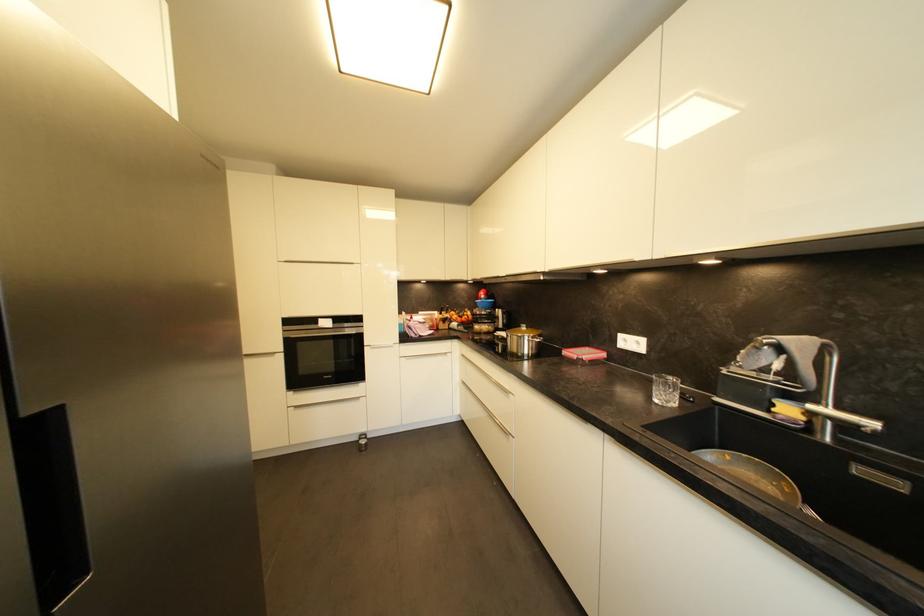
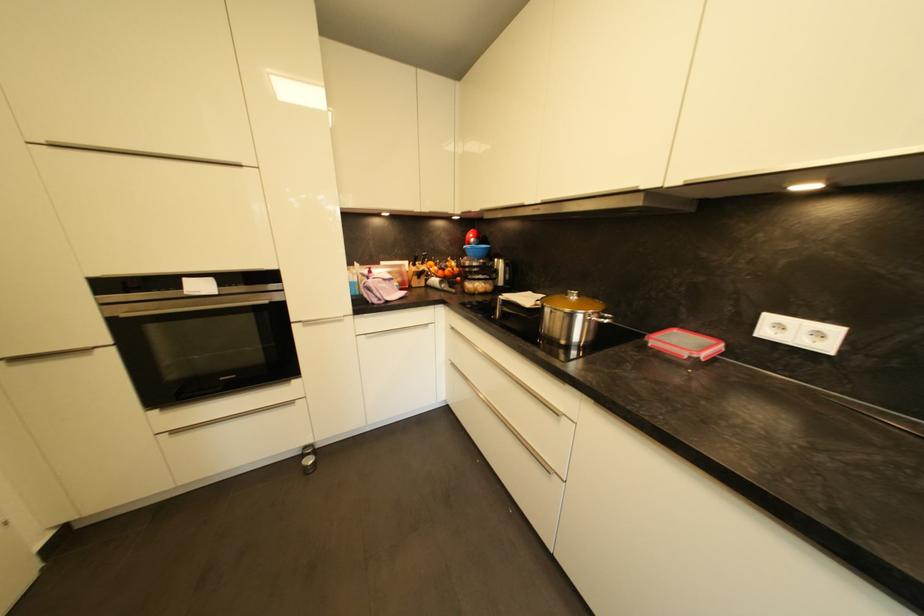
Locate, in the second image, the point that corresponds to the point at 292,264 in the first image.

(58, 148)